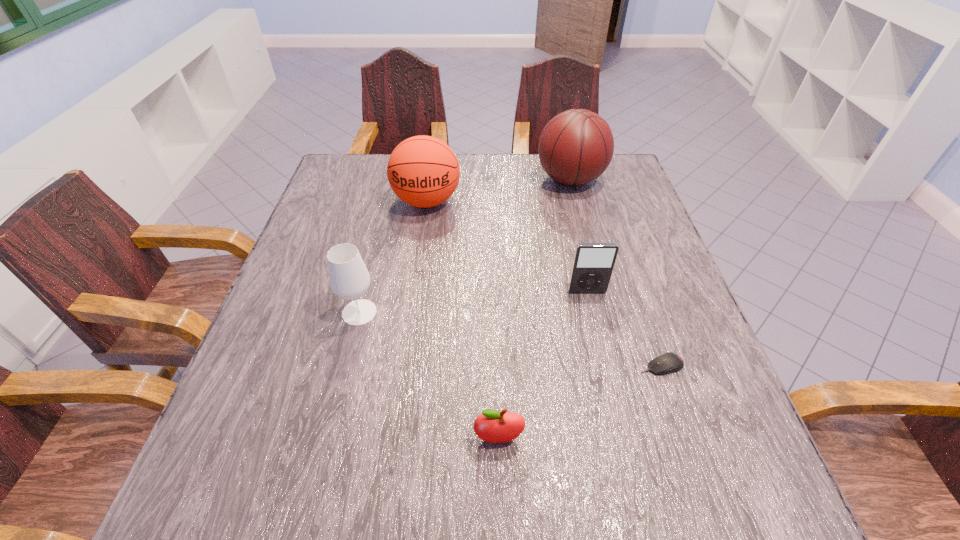
The width and height of the screenshot is (960, 540). I want to click on the right basketball, so click(576, 146).

Where is `the left basketball`? the left basketball is located at coordinates (423, 171).

Find the location of a particular element. Image resolution: width=960 pixels, height=540 pixels. glass is located at coordinates (349, 278).

At what (x,y) coordinates should I click in order to perform the action: click on iPod. Please return your answer as a coordinate pair (x, y). This screenshot has width=960, height=540. Looking at the image, I should click on (593, 264).

The width and height of the screenshot is (960, 540). What are the coordinates of `the third shortest object` in the screenshot? It's located at (593, 264).

Find the location of `the nearest object`. the nearest object is located at coordinates (492, 426).

Find the location of a particular element. The image size is (960, 540). the fifth tallest object is located at coordinates (492, 426).

You are a GUI agent. You are given a task and a screenshot of the screen. Output one action in this format:
    pyautogui.click(x=<x>, y=<y>)
    Task: Click on the fifth farthest object
    Image resolution: width=960 pixels, height=540 pixels.
    Given the screenshot: What is the action you would take?
    pyautogui.click(x=666, y=363)

This screenshot has width=960, height=540. Find the location of `the shortest object`. the shortest object is located at coordinates (666, 363).

The image size is (960, 540). I want to click on free location located 0.100m on the left of the right basketball, so click(x=502, y=180).